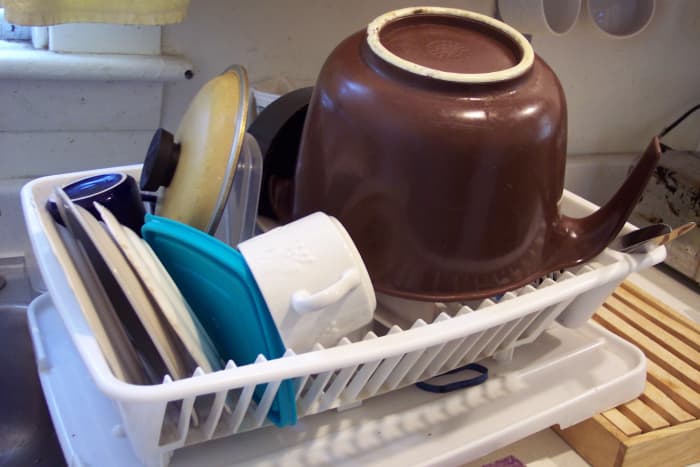
Identify the location of window in the background to the left. (4, 27).